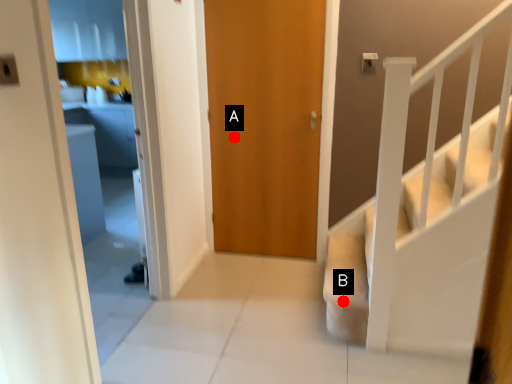
Question: Two points are circled on the image, labeled by A and B beside each circle. Which point is further to the camera?

Choices:
 (A) A is further
 (B) B is further

Answer: (A)